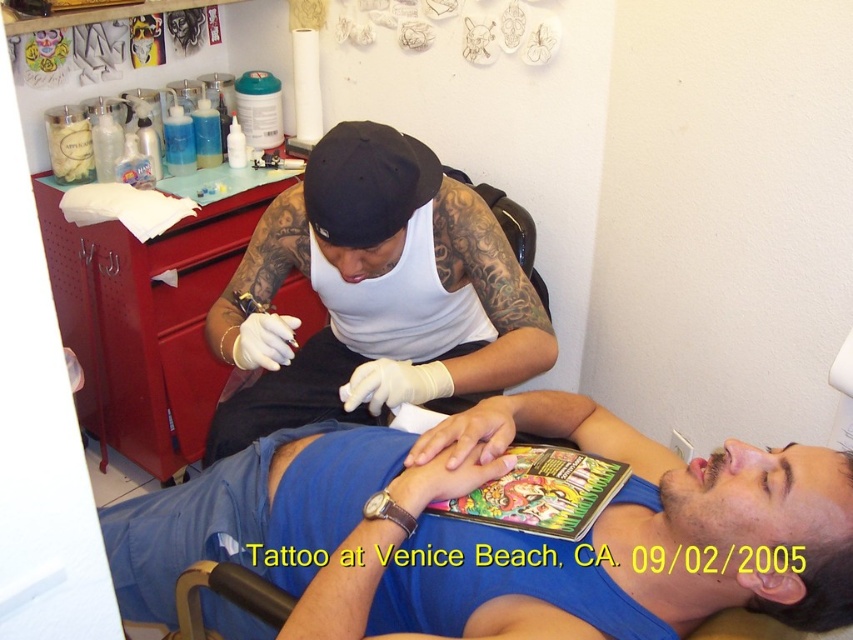
Question: Among these points, which one is nearest to the camera?

Choices:
 (A) coord(561,628)
 (B) coord(471,369)

Answer: (A)

Question: Which of the following is the closest to the observer?

Choices:
 (A) (442, 196)
 (B) (547, 541)

Answer: (B)

Question: Does blue fabric at lower center appear over white matte tank top at upper center?

Choices:
 (A) no
 (B) yes

Answer: (A)

Question: Which of the following is the closest to the observer?

Choices:
 (A) (393, 576)
 (B) (479, 240)

Answer: (A)

Question: Does blue fabric at lower center have a lesser width compared to white matte tank top at upper center?

Choices:
 (A) yes
 (B) no

Answer: (B)

Question: Is blue fabric at lower center wider than white matte tank top at upper center?

Choices:
 (A) no
 (B) yes

Answer: (B)